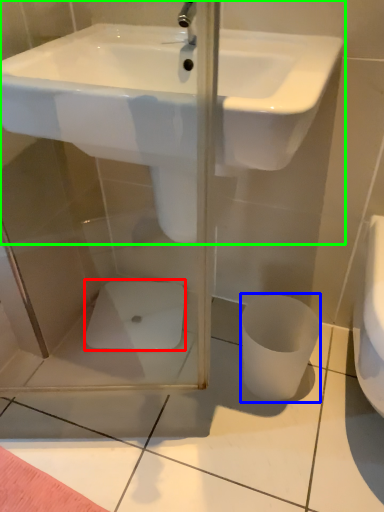
Question: Which is nearer to the porcelain (highlighted by a red box)? toilet bowl (highlighted by a blue box) or sink (highlighted by a green box).

Choices:
 (A) toilet bowl
 (B) sink

Answer: (A)